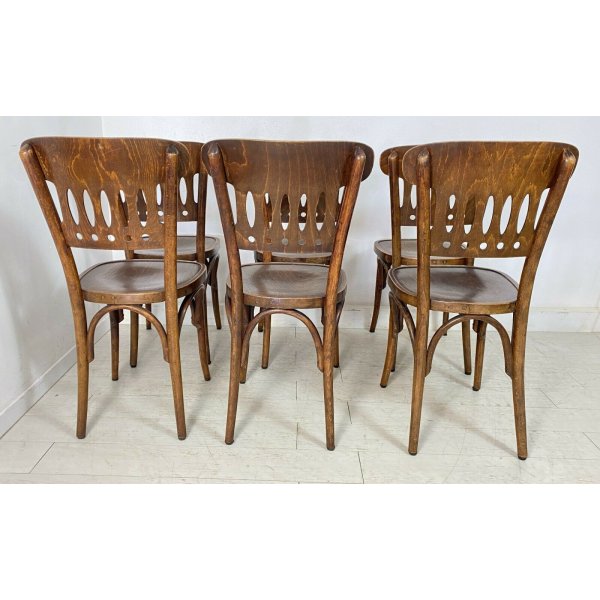
Where is `chairs`? chairs is located at coordinates (129, 179), (294, 171), (487, 173), (395, 164), (317, 257), (211, 247).